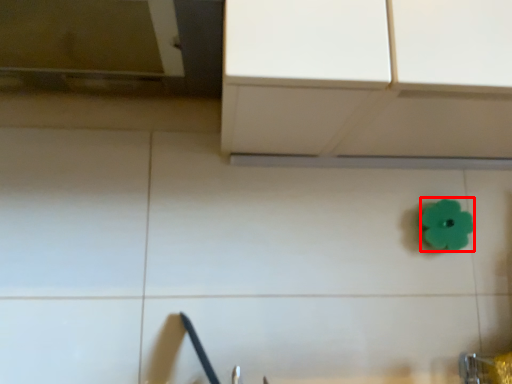
Question: From the image, what is the correct spatial relationship of flower (annotated by the red box) in relation to faucet?

Choices:
 (A) left
 (B) right

Answer: (B)